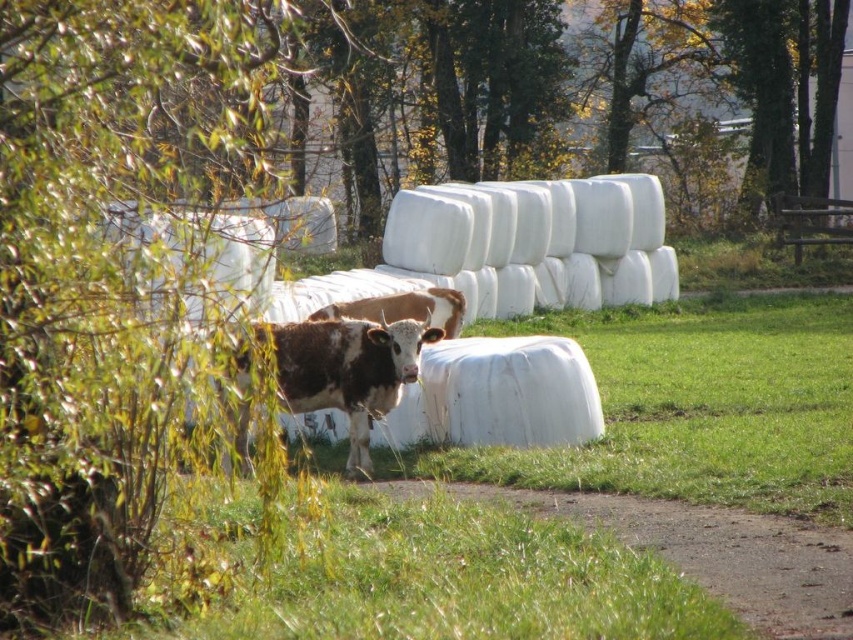
Which is more to the right, brown speckled hide at center or brown speckled cow at center?

brown speckled hide at center

Can you confirm if brown speckled hide at center is positioned to the right of brown speckled cow at center?

Yes, brown speckled hide at center is to the right of brown speckled cow at center.

Is point (375, 376) closer to viewer compared to point (444, 292)?

That is True.

You are a GUI agent. You are given a task and a screenshot of the screen. Output one action in this format:
    pyautogui.click(x=<x>, y=<y>)
    Task: Click on the brown speckled hide at center
    The width and height of the screenshot is (853, 640).
    Given the screenshot: What is the action you would take?
    pyautogui.click(x=347, y=371)